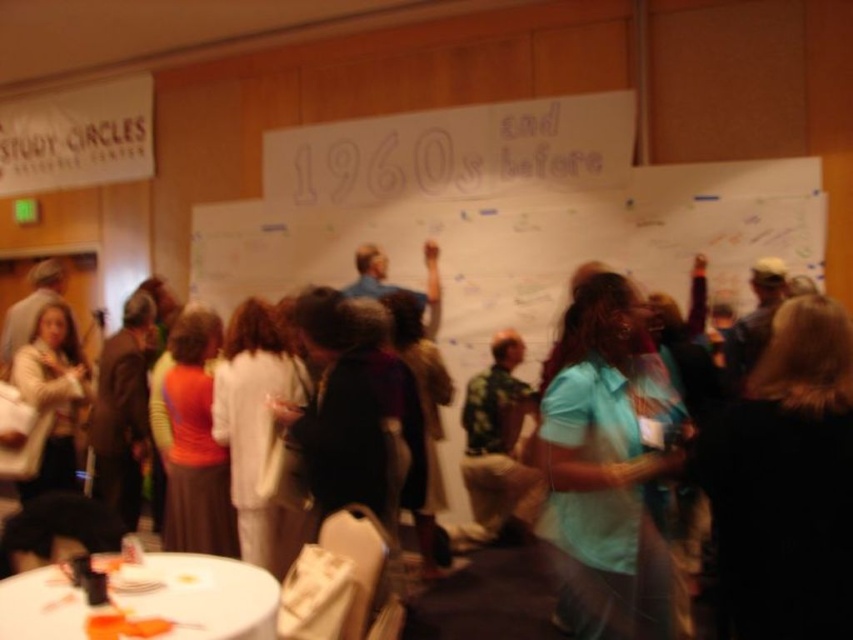
Question: Which point is closer to the camera taking this photo?

Choices:
 (A) (259, 588)
 (B) (643, 522)
 (C) (517, 516)

Answer: (B)

Question: Which point is farther to the camera?

Choices:
 (A) light blue shirt at center
 (B) camouflage shirt at center
 (C) white plastic table at lower left

Answer: (B)

Question: Can you confirm if light blue shirt at center is thinner than white plastic table at lower left?

Choices:
 (A) no
 (B) yes

Answer: (B)

Question: In this image, where is white plastic table at lower left located relative to camouflage shirt at center?

Choices:
 (A) below
 (B) above

Answer: (A)

Question: Can you confirm if light blue shirt at center is positioned above camouflage shirt at center?

Choices:
 (A) yes
 (B) no

Answer: (A)

Question: Which point appears farthest from the camera in this image?

Choices:
 (A) (494, 438)
 (B) (35, 611)

Answer: (A)